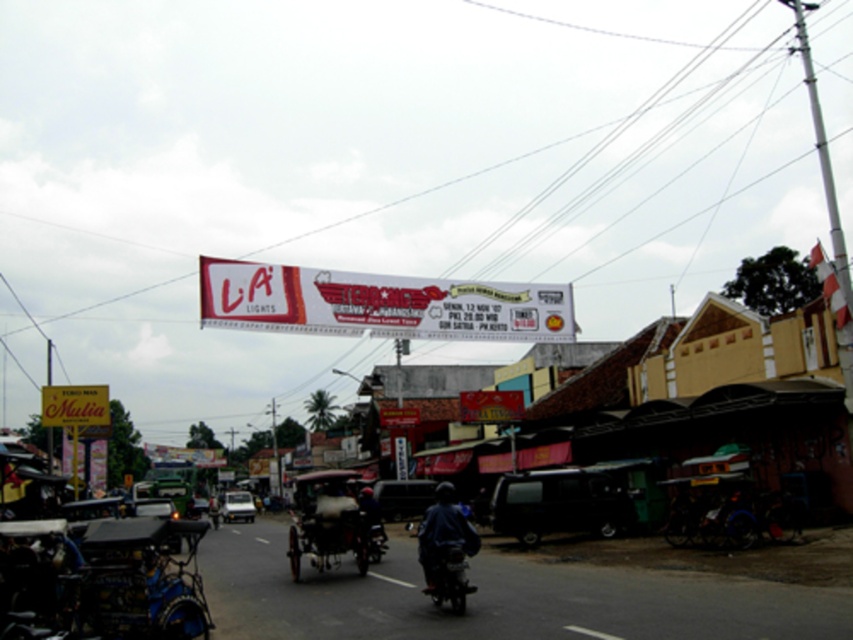
Does point (302, 324) come closer to viewer compared to point (421, 538)?

No, (302, 324) is further to viewer.

Is white glossy banner at center smaller than dark blue matte motorcycle at center?

No.

Locate an element on the screen. Image resolution: width=853 pixels, height=640 pixels. white glossy banner at center is located at coordinates (379, 305).

Is dark blue matte motorcycle at center further to the viewer compared to metallic silver car at center?

No, dark blue matte motorcycle at center is closer to the viewer.

Measure the distance from dark blue matte motorcycle at center to metallic silver car at center.

The distance of dark blue matte motorcycle at center from metallic silver car at center is 26.81 meters.

In order to click on dark blue matte motorcycle at center in this screenshot , I will do `click(445, 568)`.

You are a GUI agent. You are given a task and a screenshot of the screen. Output one action in this format:
    pyautogui.click(x=<x>, y=<y>)
    Task: Click on the dark blue matte motorcycle at center
    The height and width of the screenshot is (640, 853).
    Given the screenshot: What is the action you would take?
    pyautogui.click(x=445, y=568)

Does black matte van at center appear on the right side of dark blue matte motorcycle at center?

Indeed, black matte van at center is positioned on the right side of dark blue matte motorcycle at center.

Between point (582, 492) and point (439, 589), which one is positioned behind?

Point (582, 492)

The image size is (853, 640). In order to click on black matte van at center in this screenshot , I will do `click(560, 502)`.